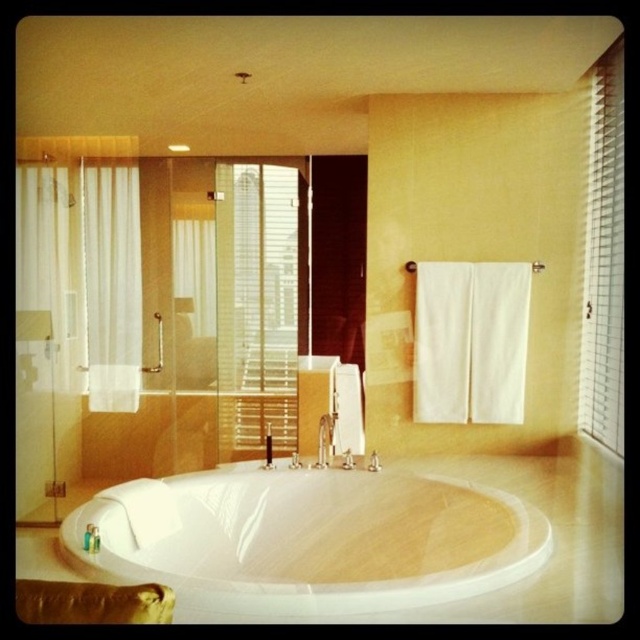
Is point (461, 582) in front of point (221, 332)?

Yes, it is in front of point (221, 332).

Which is in front, point (132, 580) or point (220, 275)?

Point (132, 580)

The width and height of the screenshot is (640, 640). In order to click on white glossy bathtub at center in this screenshot , I will do `click(308, 540)`.

This screenshot has width=640, height=640. What do you see at coordinates (257, 305) in the screenshot?
I see `white textured blinds at center` at bounding box center [257, 305].

Which is in front, point (276, 424) or point (595, 152)?

Point (595, 152) is more forward.

Is point (227, 456) positioned behind point (611, 138)?

That is True.

The image size is (640, 640). In order to click on white textured blinds at center in this screenshot , I will do `click(257, 305)`.

Can you confirm if white glossy bathtub at center is taller than white sheer curtain at left?

In fact, white glossy bathtub at center may be shorter than white sheer curtain at left.

Which is above, white glossy bathtub at center or white sheer curtain at left?

Positioned higher is white sheer curtain at left.

Who is more forward, (525, 538) or (92, 355)?

Point (525, 538)

Locate an element on the screen. The height and width of the screenshot is (640, 640). white glossy bathtub at center is located at coordinates (308, 540).